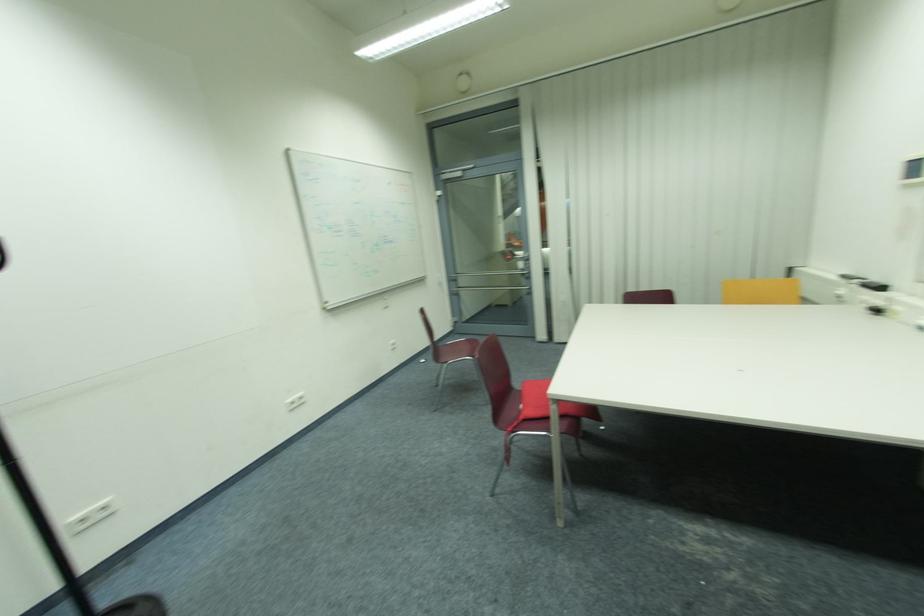
Image resolution: width=924 pixels, height=616 pixels. What are the coordinates of `red chair sitting surface` in the screenshot? It's located at (533, 399).